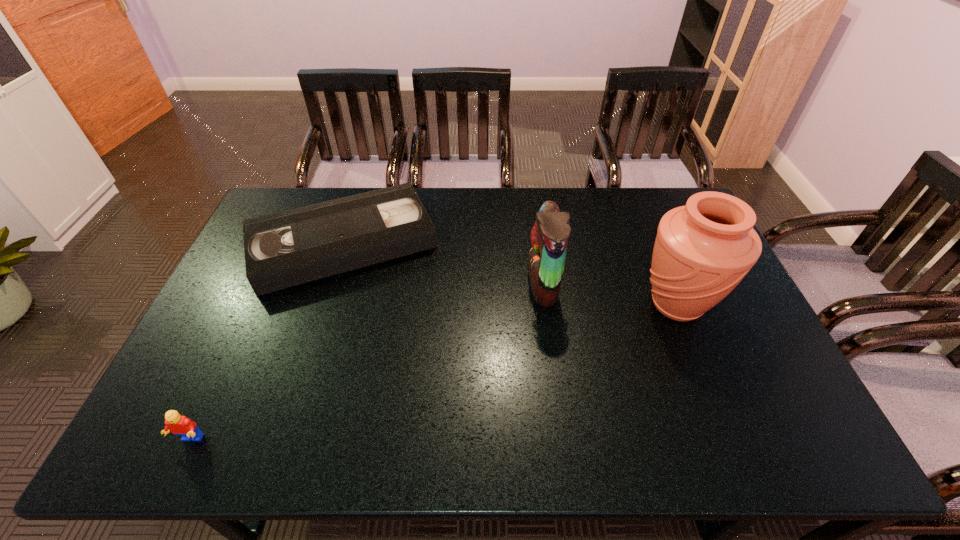
At what (x,y) coordinates should I click in order to perform the action: click on vacant space located at the face of the parrot. Please return your answer as a coordinate pair (x, y). Image resolution: width=960 pixels, height=540 pixels. Looking at the image, I should click on (440, 284).

I want to click on free space located on the right of the videotape, so click(x=476, y=243).

At what (x,y) coordinates should I click in order to perform the action: click on object that is at the far edge. Please return your answer as a coordinate pair (x, y). Image resolution: width=960 pixels, height=540 pixels. Looking at the image, I should click on (288, 248).

Locate an element on the screen. This screenshot has width=960, height=540. object present at the near edge is located at coordinates (180, 425).

You are a GUI agent. You are given a task and a screenshot of the screen. Output one action in this format:
    pyautogui.click(x=<x>, y=<y>)
    Task: Click on the Lego at the left edge
    
    Given the screenshot: What is the action you would take?
    pyautogui.click(x=180, y=425)

The height and width of the screenshot is (540, 960). What are the coordinates of `videotape that is at the left edge` in the screenshot? It's located at (288, 248).

In order to click on object located in the right edge section of the desktop in this screenshot , I will do `click(702, 251)`.

In order to click on object that is at the far left corner in this screenshot , I will do `click(288, 248)`.

At what (x,y) coordinates should I click in order to perform the action: click on object that is at the near left corner. Please return your answer as a coordinate pair (x, y). This screenshot has width=960, height=540. Looking at the image, I should click on (180, 425).

This screenshot has width=960, height=540. Identify the location of free space at the far edge. (577, 215).